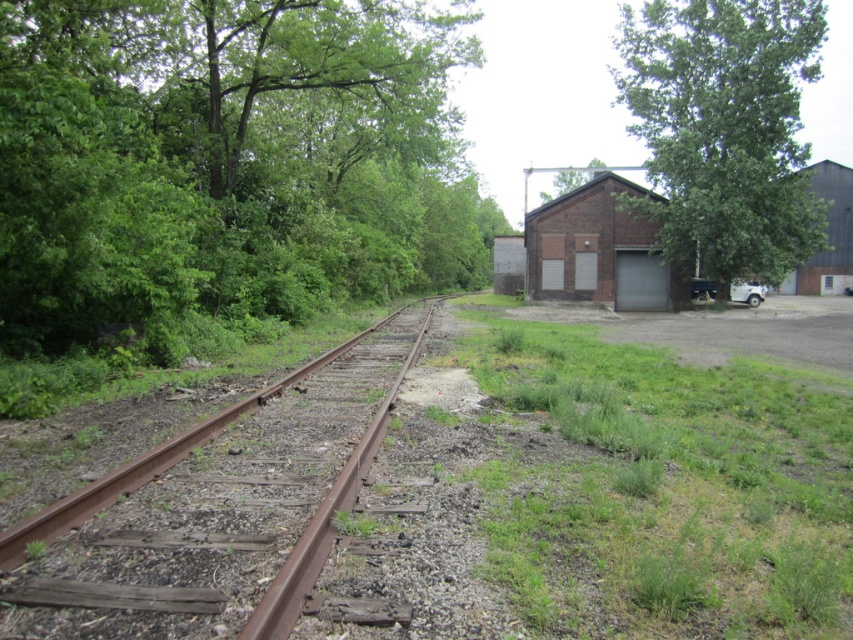
Does point (54, 8) come in front of point (759, 76)?

Yes, point (54, 8) is closer to viewer.

Is green leafy tree at left wider than green leafy tree at center-right?

Incorrect, green leafy tree at left's width does not surpass green leafy tree at center-right's.

Is point (70, 104) closer to viewer compared to point (697, 227)?

Yes, point (70, 104) is in front of point (697, 227).

Find the location of `green leafy tree at left`. green leafy tree at left is located at coordinates (225, 161).

Does green leafy tree at left have a larger size compared to green grass at lower right?

Correct, green leafy tree at left is larger in size than green grass at lower right.

Which is below, green leafy tree at left or green grass at lower right?

Positioned lower is green grass at lower right.

At what (x,y) coordinates should I click in order to perform the action: click on green leafy tree at left. Please return your answer as a coordinate pair (x, y). Looking at the image, I should click on (225, 161).

This screenshot has width=853, height=640. In order to click on green leafy tree at left in this screenshot , I will do `click(225, 161)`.

Is green grass at lower right to the right of rusty metal train track at left from the viewer's perspective?

Correct, you'll find green grass at lower right to the right of rusty metal train track at left.

Where is `green grass at lower right`? The image size is (853, 640). green grass at lower right is located at coordinates (666, 490).